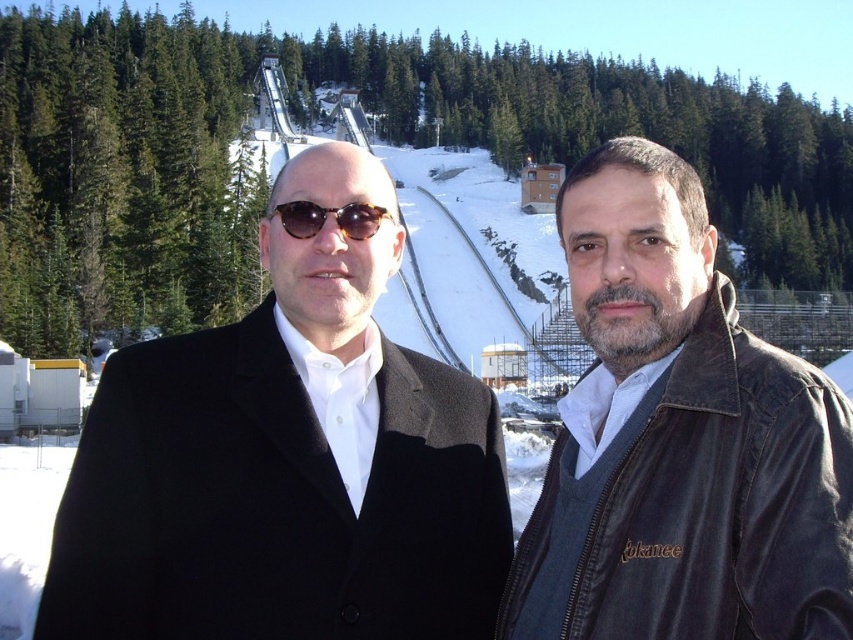
You are a photographer trying to capture both the black wool coat at left and the leather jacket at right in a single shot. Which person should you adjust your camera focus on first to ensure both are in frame?

You should focus on the black wool coat at left first since it is closer to the viewer than the leather jacket at right, ensuring both are within the camera frame.

You are a photographer trying to capture a photo of both the leather jacket at right and the matte black sunglasses at center. Since you want both subjects to be in focus, you need to know which one is taller. Can you determine which object is taller?

The leather jacket at right is much taller than the matte black sunglasses at center, so you should focus on the leather jacket at right to ensure both are in focus.